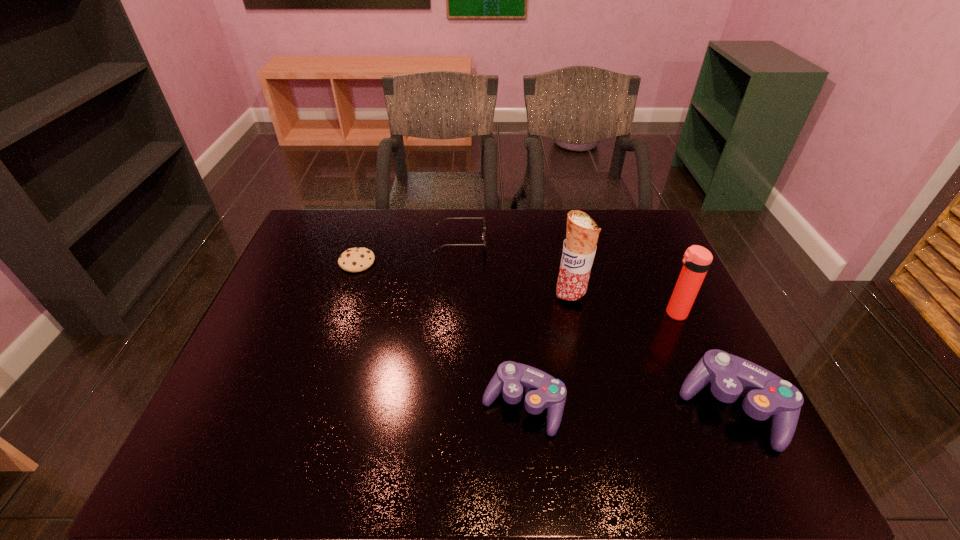
You are a GUI agent. You are given a task and a screenshot of the screen. Output one action in this format:
    pyautogui.click(x=<x>, y=<y>)
    Task: Click on the shorter control
    This screenshot has width=960, height=540.
    Given the screenshot: What is the action you would take?
    pyautogui.click(x=542, y=390)

Identify the location of the third shortest object. (x=542, y=390).

Locate an element on the screen. the fourth shortest object is located at coordinates (765, 394).

I want to click on the taller control, so click(765, 394).

At what (x,y) coordinates should I click in order to perform the action: click on the second shortest object. Please return your answer as a coordinate pair (x, y). Looking at the image, I should click on (483, 234).

Locate an element on the screen. the shortest object is located at coordinates (358, 259).

Identify the location of cookie. (358, 259).

At what (x,y) coordinates should I click in order to perform the action: click on the third object from right to left. Please return your answer as a coordinate pair (x, y). Looking at the image, I should click on (579, 248).

The height and width of the screenshot is (540, 960). What are the coordinates of `burrito` in the screenshot? It's located at (579, 248).

You are a GUI agent. You are given a task and a screenshot of the screen. Output one action in this format:
    pyautogui.click(x=<x>, y=<y>)
    Task: Click on the fifth shortest object
    The image size is (960, 540).
    Given the screenshot: What is the action you would take?
    pyautogui.click(x=696, y=261)